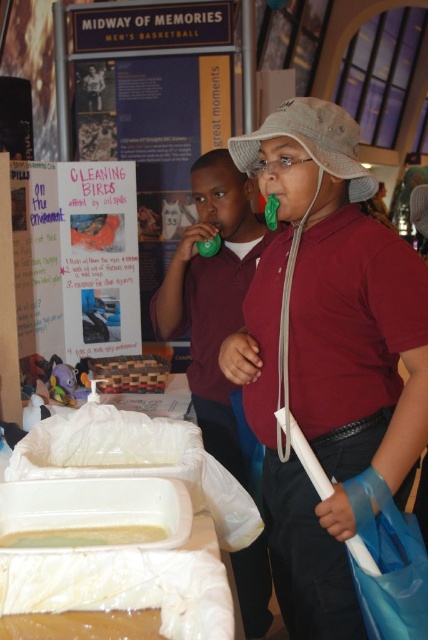
Question: Which object is positioned farthest from the translucent plastic container at center?

Choices:
 (A) matte green whistle at center
 (B) wooden blocks at center

Answer: (B)

Question: Can you confirm if green rubber whistle at center is positioned to the right of wooden blocks at center?

Choices:
 (A) yes
 (B) no

Answer: (A)

Question: Among these points, which one is nearest to the camera?

Choices:
 (A) (24, 536)
 (B) (299, 419)
 (C) (202, 380)
 (D) (151, 388)

Answer: (A)

Question: Does matte green whistle at center appear on the left side of wooden blocks at center?

Choices:
 (A) yes
 (B) no

Answer: (B)

Question: Which point is farther to the camera?

Choices:
 (A) green rubber whistle at center
 (B) translucent plastic container at center

Answer: (A)

Question: Is translucent plastic container at center to the left of wooden blocks at center from the viewer's perspective?

Choices:
 (A) no
 (B) yes

Answer: (A)